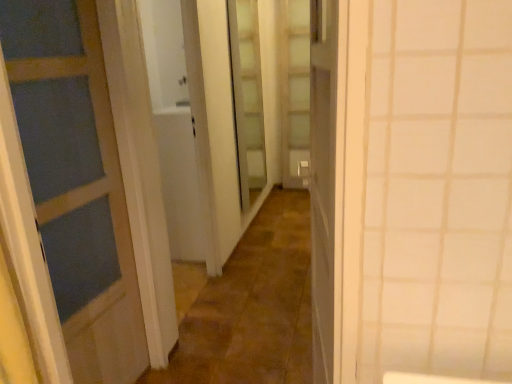
Question: From a real-world perspective, relative to clear glass door at center, acting as the 1th screen door starting from the left, is translucent glass screen door at center, the second screen door from the front, vertically above or below?

Choices:
 (A) above
 (B) below

Answer: (B)

Question: From their relative heights in the image, would you say translucent glass screen door at center, which is counted as the 2th screen door, starting from the left, is taller or shorter than clear glass door at center, which is the first screen door from front to back?

Choices:
 (A) tall
 (B) short

Answer: (A)

Question: Estimate the real-world distances between objects in this image. Which object is farther from the brown stone alley at center?

Choices:
 (A) clear glass door at center, which is the first screen door from front to back
 (B) translucent glass screen door at center, the 1th screen door from the back

Answer: (B)

Question: Estimate the real-world distances between objects in this image. Which object is farther from the brown stone alley at center?

Choices:
 (A) clear glass door at center, which is the first screen door from front to back
 (B) translucent glass screen door at center, which is counted as the 2th screen door, starting from the left

Answer: (B)